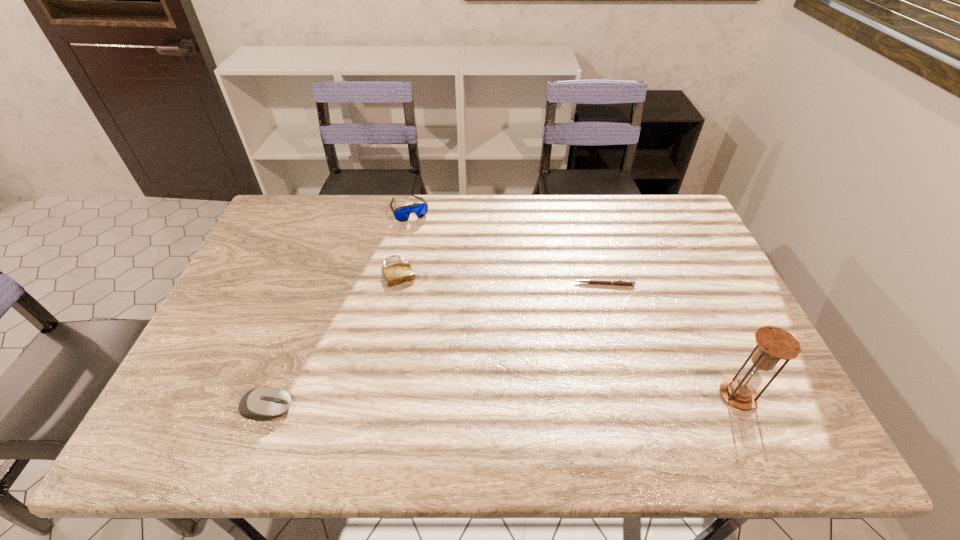
I want to click on vacant region located on the back of the hourglass, so click(x=721, y=359).

Find the location of `free region located 0.330m on the keyhole side of the padlock`. free region located 0.330m on the keyhole side of the padlock is located at coordinates (445, 374).

At what (x,y) coordinates should I click in order to perform the action: click on vacant space situated on the keyhole side of the padlock. Please return your answer as a coordinate pair (x, y). Looking at the image, I should click on (444, 370).

The width and height of the screenshot is (960, 540). I want to click on vacant point located on the keyhole side of the padlock, so click(x=422, y=325).

Locate an element on the screen. Image resolution: width=960 pixels, height=540 pixels. vacant position located 0.310m on the front-facing side of the fourth shortest object is located at coordinates (444, 281).

Where is `free space located 0.120m on the front-facing side of the fourth shortest object`? The image size is (960, 540). free space located 0.120m on the front-facing side of the fourth shortest object is located at coordinates (426, 243).

Image resolution: width=960 pixels, height=540 pixels. In order to click on vacant space located on the front-facing side of the fourth shortest object in this screenshot , I will do `click(442, 275)`.

This screenshot has width=960, height=540. I want to click on blank space located 0.130m at the nib of the fourth object from left to right, so click(565, 313).

Image resolution: width=960 pixels, height=540 pixels. I want to click on free location located at the nib of the fourth object from left to right, so click(x=569, y=309).

The image size is (960, 540). Identify the location of vacant space located at the nib of the fourth object from left to right. [574, 302].